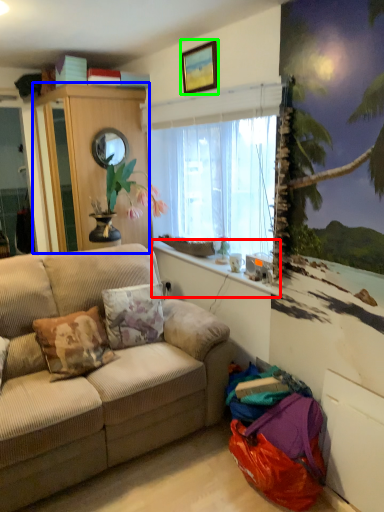
Question: Which object is positioned farthest from window sill (highlighted by a red box)? Select from cabinetry (highlighted by a blue box) and picture frame (highlighted by a green box).

Choices:
 (A) cabinetry
 (B) picture frame

Answer: (B)